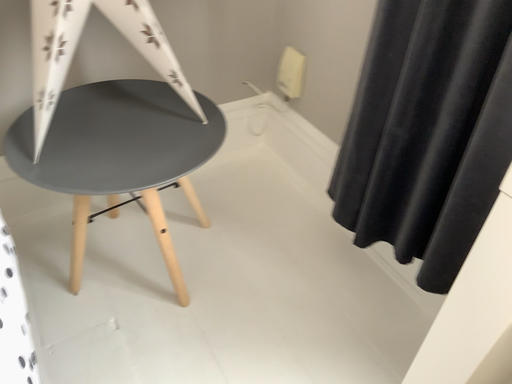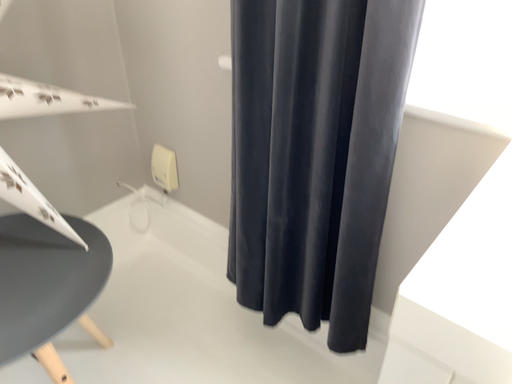
Question: How did the camera likely rotate when shooting the video?

Choices:
 (A) rotated upward
 (B) rotated downward

Answer: (A)